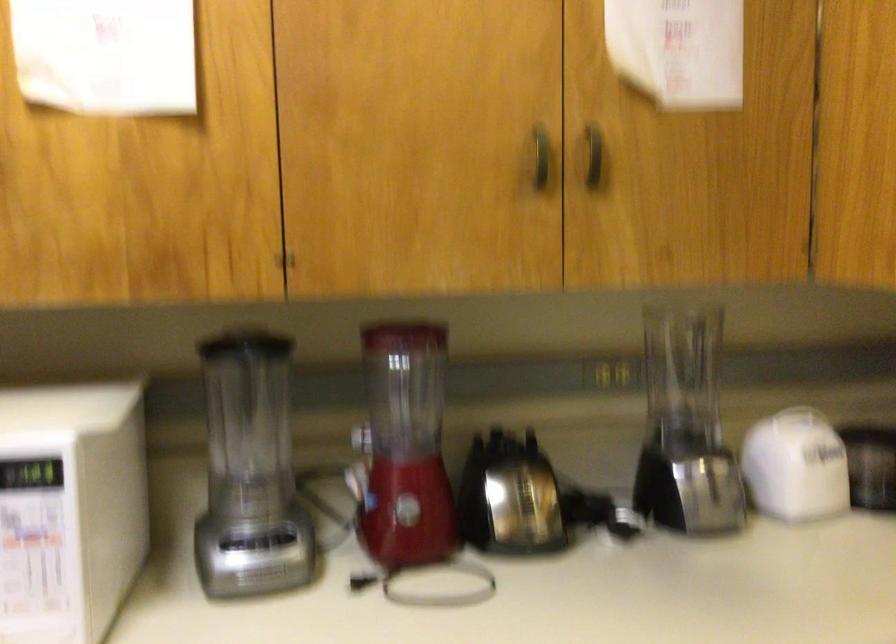
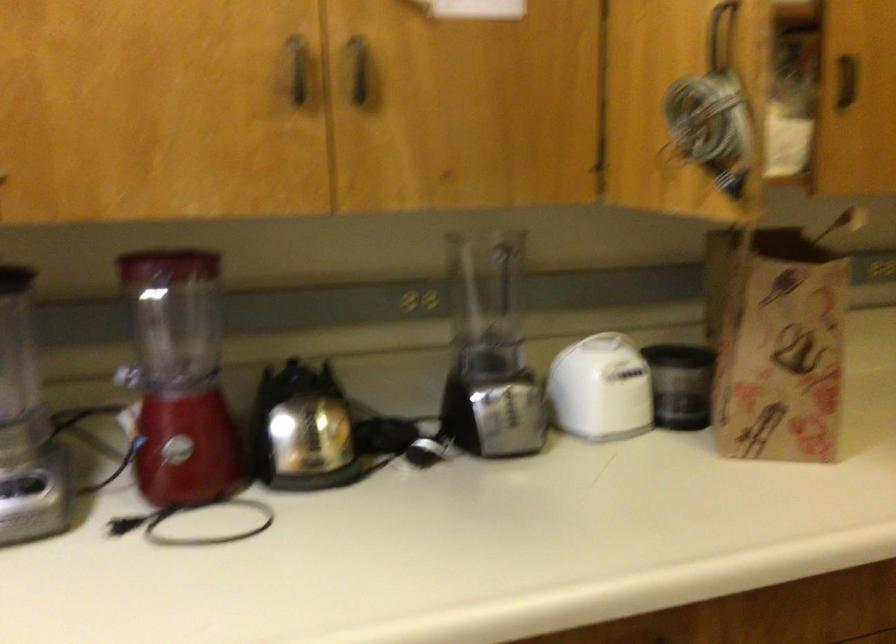
Locate, in the second image, the point that corresponds to (x=693, y=428) in the first image.

(489, 351)